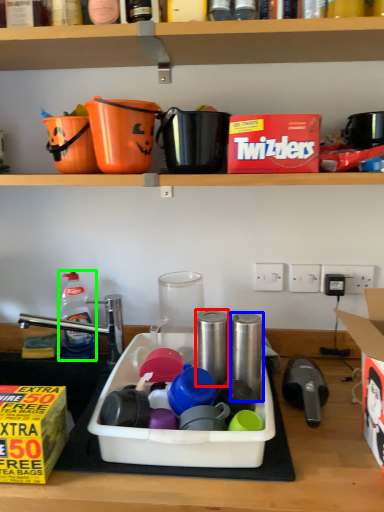
Question: Based on their relative distances, which object is farther from appliance (highlighted by a red box)? Choose from appliance (highlighted by a blue box) and bottle (highlighted by a green box).

Choices:
 (A) appliance
 (B) bottle

Answer: (B)